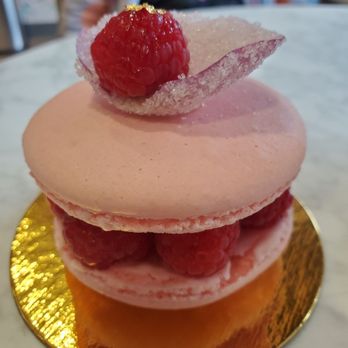
Locate an element on the screen. Image resolution: width=348 pixels, height=348 pixels. gold platter is located at coordinates (169, 328).